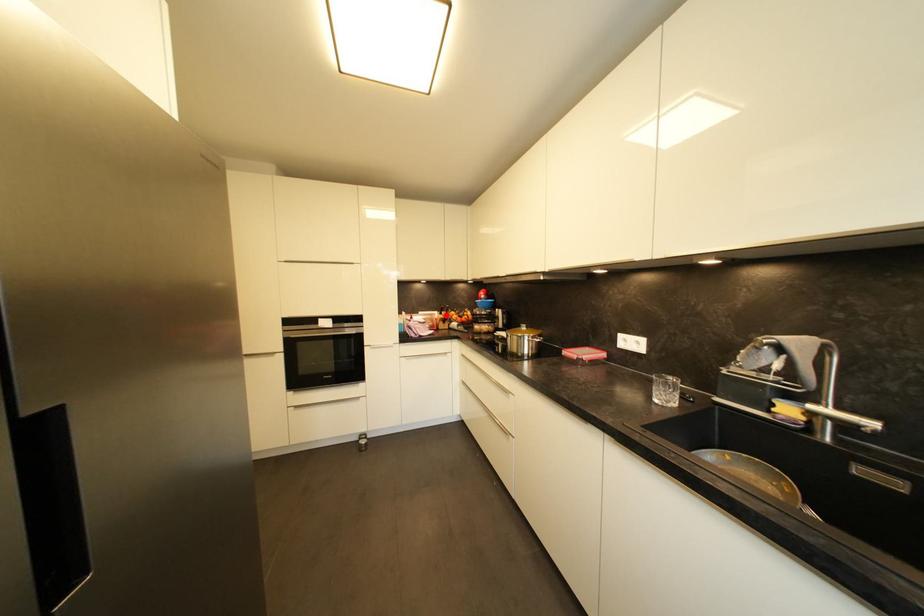
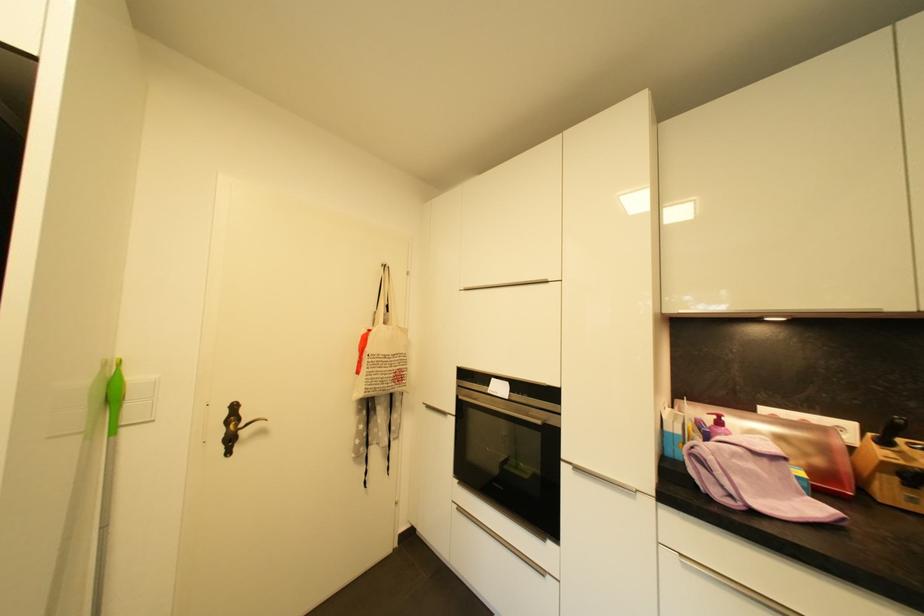
Find the pixel in the second image that matches the highlighted location in the first image.

(890, 445)